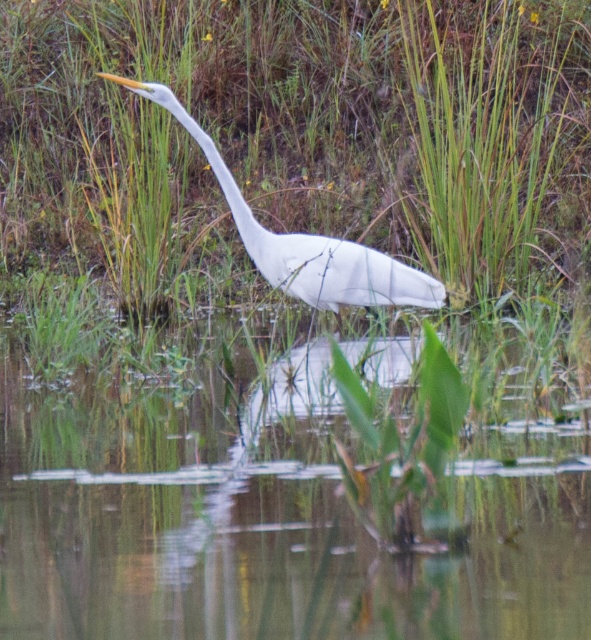
This screenshot has height=640, width=591. Describe the element at coordinates (294, 132) in the screenshot. I see `green grass at center` at that location.

Does point (43, 243) lie behind point (131, 465)?

That is True.

You are a GUI agent. You are given a task and a screenshot of the screen. Output one action in this format:
    pyautogui.click(x=<x>, y=<y>)
    Task: Click on the green grass at center
    This screenshot has height=640, width=591.
    Given the screenshot: What is the action you would take?
    pyautogui.click(x=294, y=132)

Who is shorter, green grass at center or white smooth heron at center?

With less height is green grass at center.

Is point (524, 209) positioned behind point (252, 259)?

Yes, point (524, 209) is farther from viewer.

Is point (129, 22) behind point (278, 264)?

Yes, it is behind point (278, 264).

Find the location of `green grass at center`. green grass at center is located at coordinates (294, 132).

Who is shorter, transparent plastic water at center or white smooth heron at center?

With less height is transparent plastic water at center.

Can you confirm if transparent plastic water at center is positioned to the right of white smooth heron at center?

No, transparent plastic water at center is not to the right of white smooth heron at center.

This screenshot has height=640, width=591. What are the coordinates of `transparent plastic water at center` in the screenshot? It's located at (268, 522).

Locate an element on the screen. transparent plastic water at center is located at coordinates [x=268, y=522].